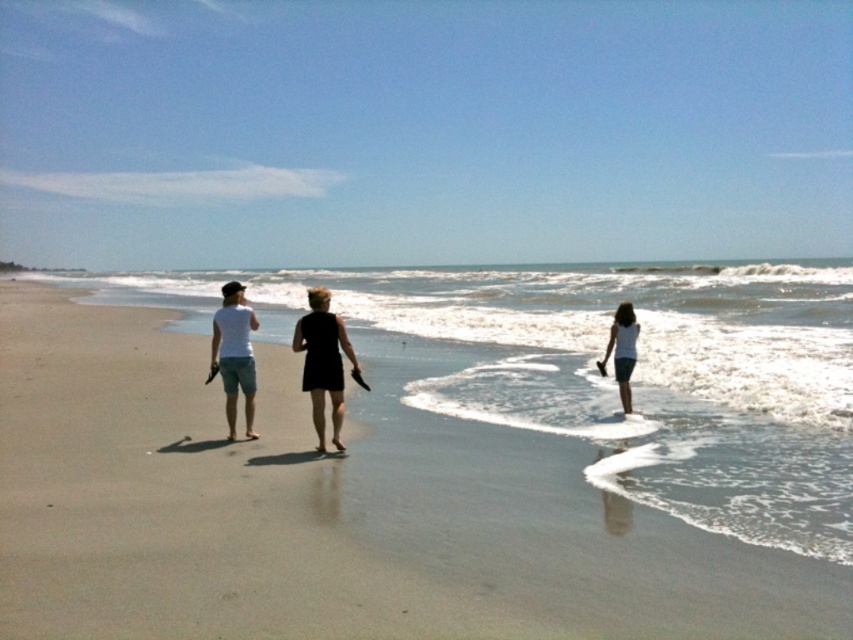
You are standing at the origin point in the beach scene. There is a white cotton shirt at center marked by point [323,362]. If you walk straight ahead, will you reach the white cotton shirt at center before the ocean waves?

The white cotton shirt at center is represented by point [323,362], so walking straight ahead from the origin point would first encounter the white cotton shirt at center before reaching the ocean waves.

You are standing at the beach and see two points marked on the sand. The first point is at coordinates point (x=306, y=360) and the second point is at point (x=309, y=390). Which point is closer to you?

Point (x=306, y=360) is further to the camera than point (x=309, y=390), so the point closer to you is point (x=309, y=390).